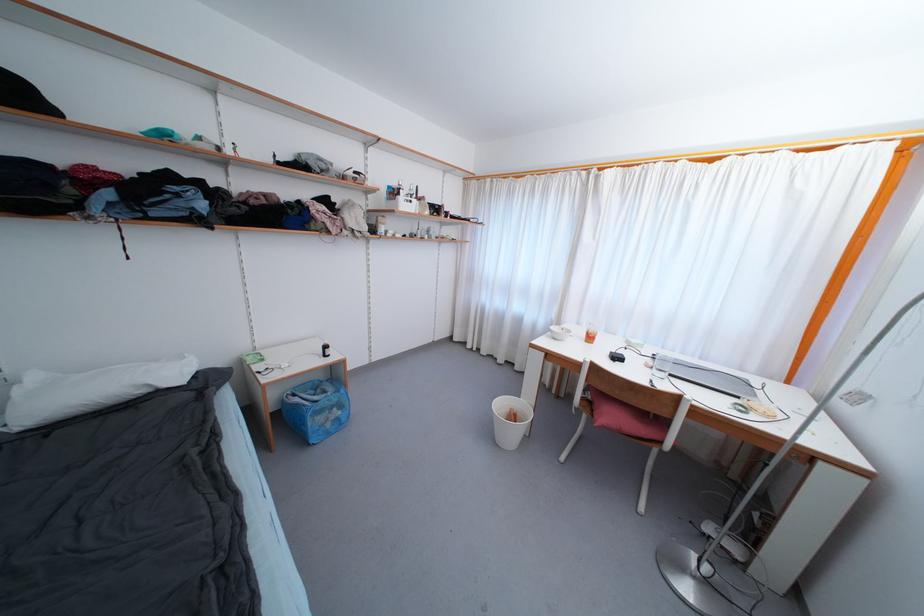
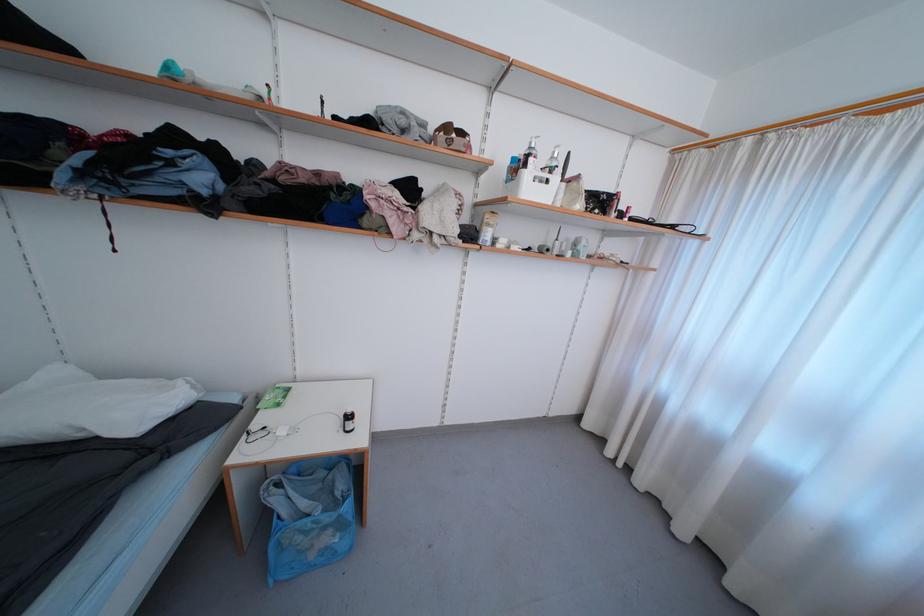
Where in the second image is the point corresponding to (x=333, y=354) from the first image?

(354, 429)